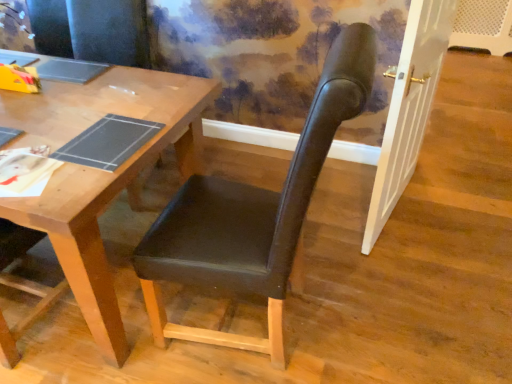
Question: Considering the positions of black leather chair at center and wooden desk at center in the image, is black leather chair at center taller or shorter than wooden desk at center?

Choices:
 (A) short
 (B) tall

Answer: (B)

Question: Is point (142, 283) positioned closer to the camera than point (115, 345)?

Choices:
 (A) closer
 (B) farther

Answer: (A)

Question: In the image, is black leather chair at center positioned in front of or behind wooden desk at center?

Choices:
 (A) behind
 (B) front

Answer: (B)

Question: Is wooden desk at center wider or thinner than black leather chair at center?

Choices:
 (A) wide
 (B) thin

Answer: (A)

Question: Is wooden desk at center inside or outside of black leather chair at center?

Choices:
 (A) outside
 (B) inside

Answer: (A)

Question: From their relative heights in the image, would you say wooden desk at center is taller or shorter than black leather chair at center?

Choices:
 (A) short
 (B) tall

Answer: (A)

Question: From the image's perspective, relative to black leather chair at center, is wooden desk at center above or below?

Choices:
 (A) below
 (B) above

Answer: (B)